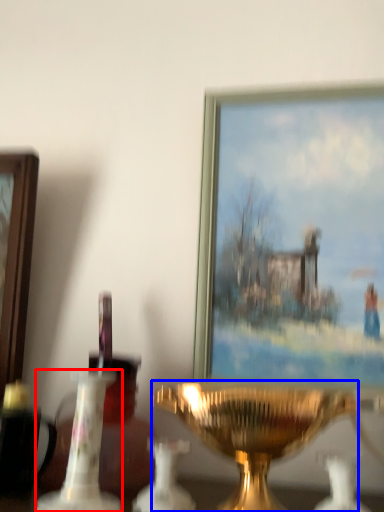
Question: Which point is further to the camera, candle holder (highlighted by a red box) or candle holder (highlighted by a blue box)?

Choices:
 (A) candle holder
 (B) candle holder

Answer: (A)